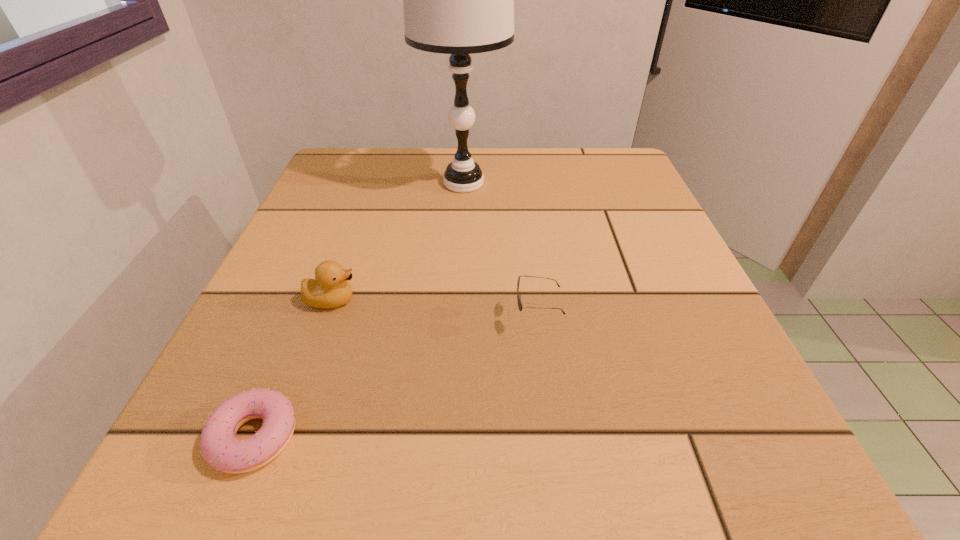
You are a GUI agent. You are given a task and a screenshot of the screen. Output one action in this format:
    pyautogui.click(x=<x>, y=<y>)
    Task: Click on the farthest object
    This screenshot has height=540, width=960.
    Given the screenshot: What is the action you would take?
    pyautogui.click(x=459, y=0)

Where is `the tallest object`? the tallest object is located at coordinates (459, 0).

Identify the location of duckling. Image resolution: width=960 pixels, height=540 pixels. (330, 289).

Find the location of a particular element. This screenshot has width=960, height=540. sunglasses is located at coordinates (520, 305).

At what (x,y) coordinates should I click in order to perform the action: click on the nearest object. Please return your answer as a coordinate pair (x, y). Looking at the image, I should click on (221, 449).

The width and height of the screenshot is (960, 540). I want to click on the shortest object, so click(221, 449).

Image resolution: width=960 pixels, height=540 pixels. Identify the location of free location located on the front of the table lamp. (456, 319).

Find the location of a particular element. This screenshot has width=960, height=540. vacant area situated on the face of the duckling is located at coordinates (503, 300).

What are the coordinates of `vacant region located in front of the lenses of the sunglasses` in the screenshot? It's located at (303, 319).

You are a GUI agent. You are given a task and a screenshot of the screen. Output one action in this format:
    pyautogui.click(x=<x>, y=<y>)
    Task: Click on the free space located in front of the lenses of the sunglasses
    This screenshot has width=960, height=540.
    Given the screenshot: What is the action you would take?
    pyautogui.click(x=369, y=319)